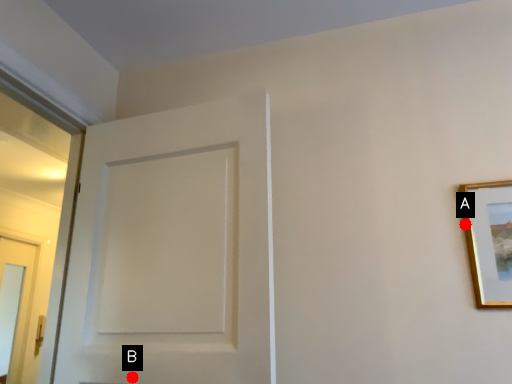
Question: Two points are circled on the image, labeled by A and B beside each circle. Which point is closer to the camera?

Choices:
 (A) A is closer
 (B) B is closer

Answer: (B)